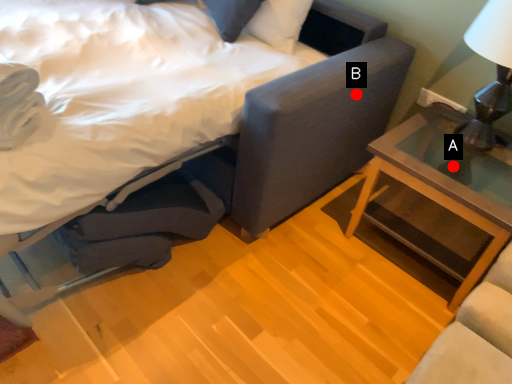
Question: Two points are circled on the image, labeled by A and B beside each circle. Among these points, which one is farthest from the camera?

Choices:
 (A) A is further
 (B) B is further

Answer: (A)